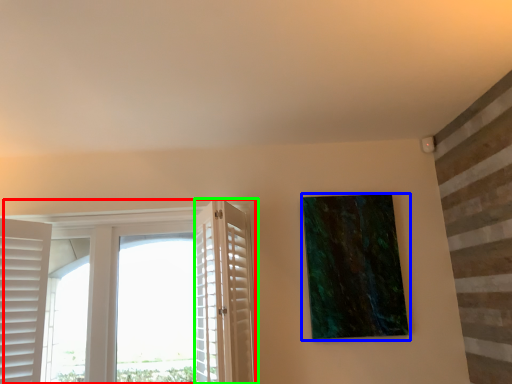
Question: Which object is the farthest from window (highlighted by a red box)? Choose among these: picture frame (highlighted by a blue box) or screen door (highlighted by a green box).

Choices:
 (A) picture frame
 (B) screen door

Answer: (A)